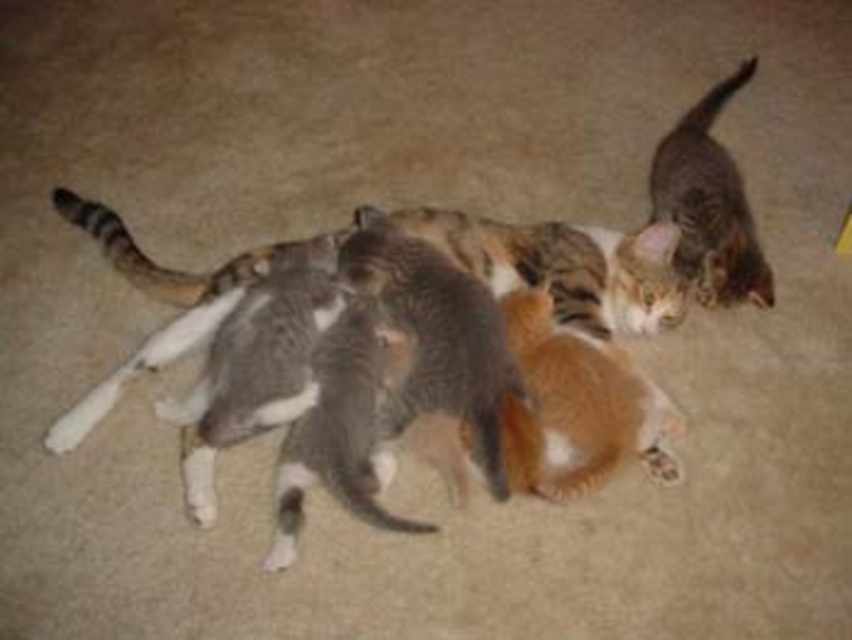
Does gray fur cat at center have a greater width compared to tabby fur cat at upper right?

Indeed, gray fur cat at center has a greater width compared to tabby fur cat at upper right.

Does point (240, 257) come farther from viewer compared to point (684, 152)?

No, (240, 257) is in front of (684, 152).

Identify the location of gray fur cat at center. (566, 264).